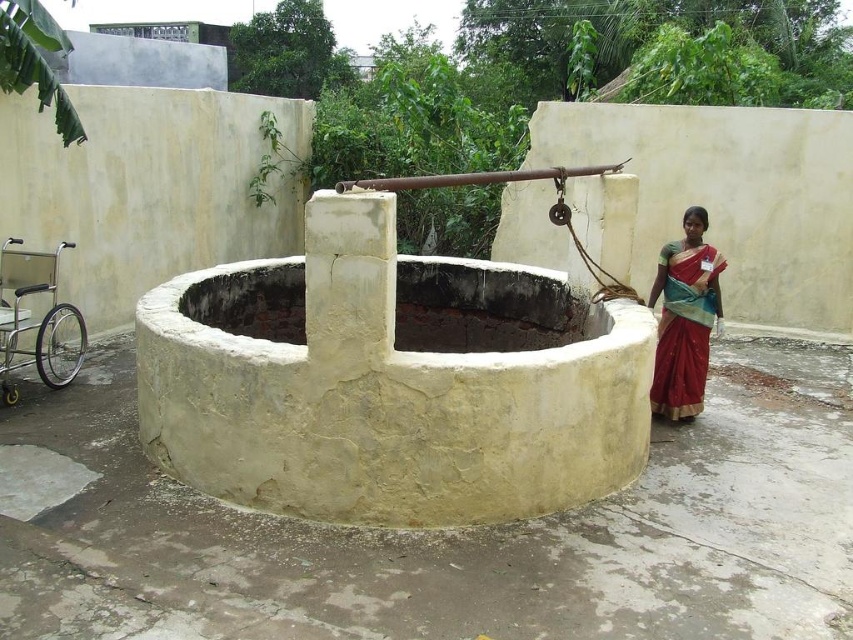
Who is positioned more to the right, red silk sari at right or silver metallic wheelchair at lower left?

red silk sari at right is more to the right.

Which is behind, point (706, 280) or point (36, 337)?

Point (36, 337)

Which is behind, point (679, 257) or point (82, 362)?

The point (82, 362) is more distant.

You are a GUI agent. You are given a task and a screenshot of the screen. Output one action in this format:
    pyautogui.click(x=<x>, y=<y>)
    Task: Click on the red silk sari at right
    This screenshot has width=853, height=640.
    Given the screenshot: What is the action you would take?
    pyautogui.click(x=683, y=317)

What do you see at coordinates (444, 532) in the screenshot? The image size is (853, 640). I see `smooth concrete well at center` at bounding box center [444, 532].

Can you confirm if smooth concrete well at center is shorter than silver metallic wheelchair at lower left?

Indeed, smooth concrete well at center has a lesser height compared to silver metallic wheelchair at lower left.

Image resolution: width=853 pixels, height=640 pixels. Find the location of `smooth concrete well at center`. smooth concrete well at center is located at coordinates (444, 532).

Which is above, smooth concrete well at center or red silk sari at right?

red silk sari at right is higher up.

Which of these two, smooth concrete well at center or red silk sari at right, stands taller?

red silk sari at right is taller.

Is point (376, 534) behind point (672, 369)?

No, it is in front of (672, 369).

In order to click on smooth concrete well at center in this screenshot , I will do `click(444, 532)`.